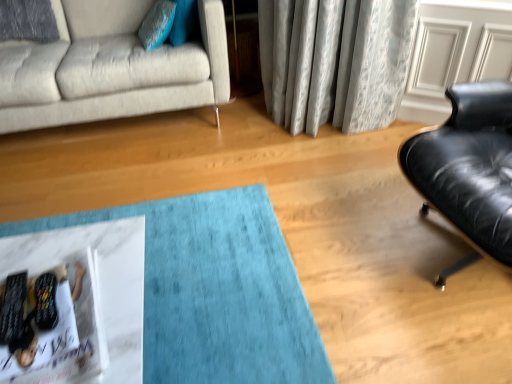
Question: Is white glossy magazine at lower left spatially inside teal fabric pillow at upper left, or outside of it?

Choices:
 (A) outside
 (B) inside

Answer: (A)

Question: From a real-world perspective, is white glossy magazine at lower left physically located above or below teal fabric pillow at upper left?

Choices:
 (A) above
 (B) below

Answer: (B)

Question: Estimate the real-world distances between objects in this image. Which object is closer to the light gray fabric couch at upper left?

Choices:
 (A) white glossy magazine at lower left
 (B) teal fabric pillow at upper left

Answer: (B)

Question: Which object is the closest to the white glossy magazine at lower left?

Choices:
 (A) teal fabric pillow at upper left
 (B) light gray fabric couch at upper left

Answer: (B)